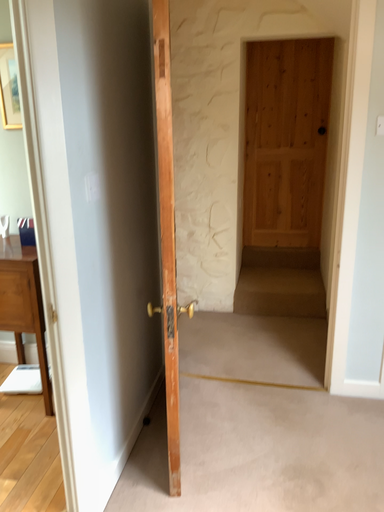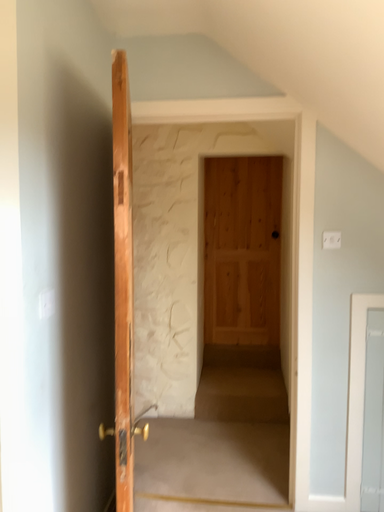
Question: How did the camera likely rotate when shooting the video?

Choices:
 (A) rotated upward
 (B) rotated downward

Answer: (A)